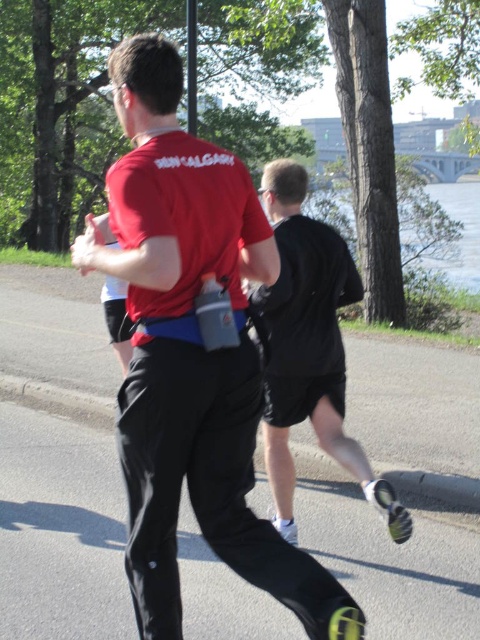
Where is `matte red shirt at center`? The width and height of the screenshot is (480, 640). matte red shirt at center is located at coordinates (192, 355).

Can you confirm if matte red shirt at center is positioned below black matte shorts at center?

Incorrect, matte red shirt at center is not positioned below black matte shorts at center.

Who is more forward, (254,525) or (326,236)?

Point (254,525) is in front.

Identify the location of matte red shirt at center. The image size is (480, 640). (192, 355).